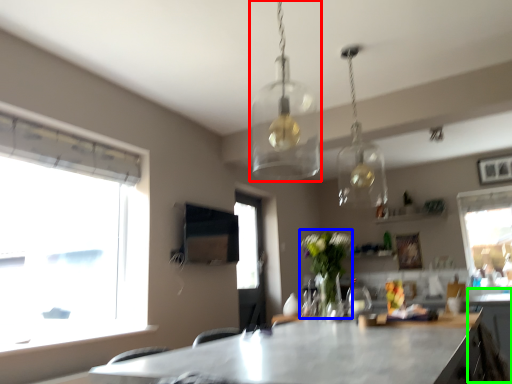
Question: Which is farther away from lamp (highlighted by a red box)? plant (highlighted by a blue box) or cabinetry (highlighted by a green box)?

Choices:
 (A) plant
 (B) cabinetry

Answer: (B)